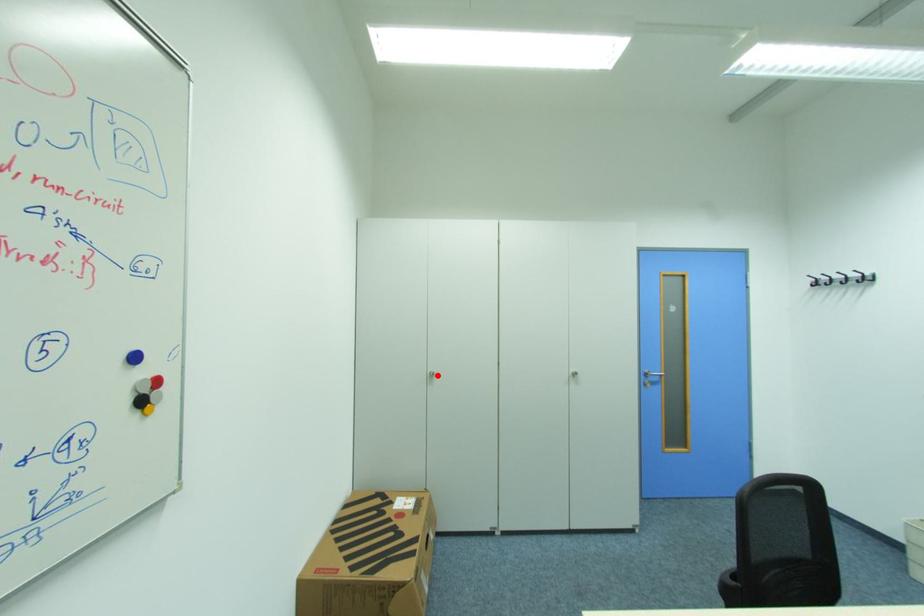
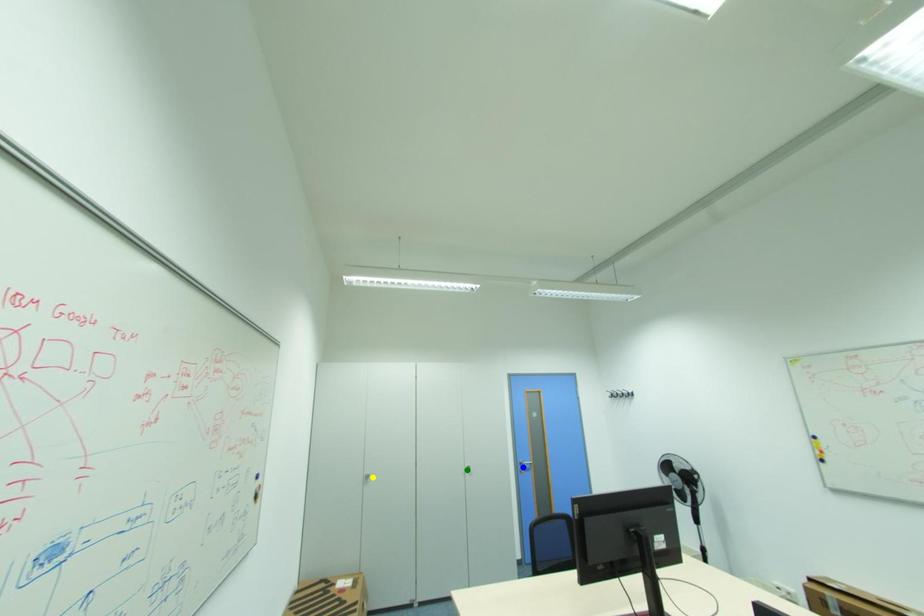
Question: I am providing you with two images of the same scene from different viewpoints. A red point is marked on the first image. You are given multiple points on the second image. Which point in image 2 is actually the same real-world point as the red point in image 1?

Choices:
 (A) green point
 (B) yellow point
 (C) blue point

Answer: (B)